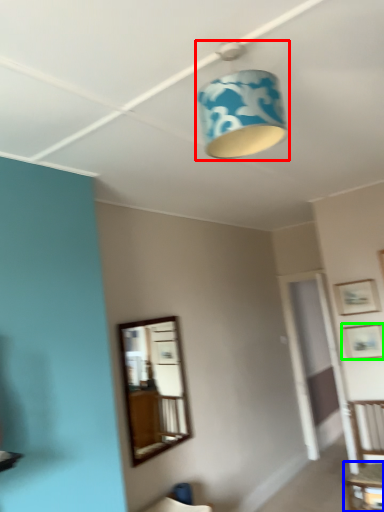
Question: Estimate the real-world distances between objects in this image. Which object is farther from lamp (highlighted by a red box), table (highlighted by a blue box) or picture frame (highlighted by a green box)?

Choices:
 (A) table
 (B) picture frame

Answer: (A)